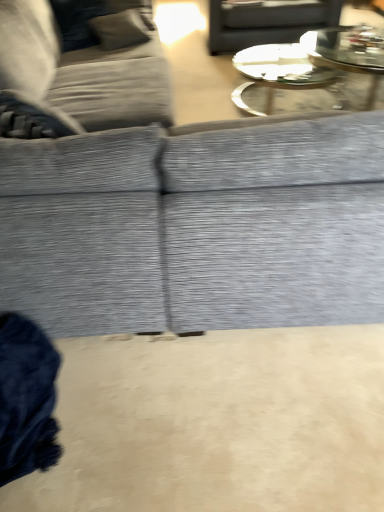
Image resolution: width=384 pixels, height=512 pixels. I want to click on matte gray tray at upper center, so click(266, 22).

This screenshot has width=384, height=512. In order to click on textured gray couch at upper left, which is counted as the 2th studio couch, starting from the right in this screenshot , I will do `click(81, 66)`.

Can textured gray couch at upper left, which ranks as the first studio couch in left-to-right order, be found inside textured gray fabric couch at center, which is the second studio couch from left to right?

Yes.

From the image's perspective, is textured gray fabric couch at center, which is the second studio couch from left to right, located above or below textured gray couch at upper left, which ranks as the first studio couch in left-to-right order?

Clearly, from the image's perspective, textured gray fabric couch at center, which is the second studio couch from left to right, is below textured gray couch at upper left, which ranks as the first studio couch in left-to-right order.

From a real-world perspective, is textured gray fabric couch at center, which is the second studio couch from left to right, positioned over textured gray couch at upper left, which is counted as the 2th studio couch, starting from the right, based on gravity?

Actually, textured gray fabric couch at center, which is the second studio couch from left to right, is physically below textured gray couch at upper left, which is counted as the 2th studio couch, starting from the right, in the real world.

Identify the location of studio couch above the textured gray fabric couch at center, positioned as the 1th studio couch in right-to-left order (from the image's perspective). (81, 66).

Considering the relative sizes of clear glass coffee table at upper center and textured gray couch at upper left, which ranks as the first studio couch in left-to-right order, in the image provided, is clear glass coffee table at upper center taller than textured gray couch at upper left, which ranks as the first studio couch in left-to-right order,?

In fact, clear glass coffee table at upper center may be shorter than textured gray couch at upper left, which ranks as the first studio couch in left-to-right order.

Considering the points (271, 105) and (23, 124), which point is behind, point (271, 105) or point (23, 124)?

Point (271, 105)

How different are the orientations of clear glass coffee table at upper center and textured gray couch at upper left, which is counted as the 2th studio couch, starting from the right, in degrees?

The angle between the facing direction of clear glass coffee table at upper center and the facing direction of textured gray couch at upper left, which is counted as the 2th studio couch, starting from the right, is 91.6 degrees.

Is textured gray couch at upper left, which is counted as the 2th studio couch, starting from the right, surrounded by clear glass coffee table at upper center?

No, textured gray couch at upper left, which is counted as the 2th studio couch, starting from the right, is not surrounded by clear glass coffee table at upper center.

At what (x,y) coordinates should I click in order to perform the action: click on gray above the textured gray fabric couch at center, positioned as the 1th studio couch in right-to-left order (from the image's perspective). Please return your answer as a coordinate pair (x, y). Looking at the image, I should click on (266, 22).

From a real-world perspective, is textured gray fabric couch at center, which is the second studio couch from left to right, beneath matte gray tray at upper center?

Actually, textured gray fabric couch at center, which is the second studio couch from left to right, is physically above matte gray tray at upper center in the real world.

Is textured gray fabric couch at center, which is the second studio couch from left to right, situated inside matte gray tray at upper center or outside?

textured gray fabric couch at center, which is the second studio couch from left to right, is not enclosed by matte gray tray at upper center.

Is point (283, 201) positioned behind point (274, 21)?

No, (283, 201) is in front of (274, 21).

Which of these two, textured gray couch at upper left, which ranks as the first studio couch in left-to-right order, or clear glass coffee table at upper center, is thinner?

textured gray couch at upper left, which ranks as the first studio couch in left-to-right order, is thinner.

From a real-world perspective, is textured gray couch at upper left, which ranks as the first studio couch in left-to-right order, over clear glass coffee table at upper center?

Indeed, from a real-world perspective, textured gray couch at upper left, which ranks as the first studio couch in left-to-right order, stands above clear glass coffee table at upper center.

How different are the orientations of textured gray couch at upper left, which ranks as the first studio couch in left-to-right order, and clear glass coffee table at upper center in degrees?

textured gray couch at upper left, which ranks as the first studio couch in left-to-right order, and clear glass coffee table at upper center are facing 91.6 degrees away from each other.

Does textured gray couch at upper left, which is counted as the 2th studio couch, starting from the right, have a larger size compared to clear glass coffee table at upper center?

Yes.

Can you confirm if textured gray couch at upper left, which is counted as the 2th studio couch, starting from the right, is thinner than matte gray tray at upper center?

No.

Which object is positioned more to the right, textured gray couch at upper left, which is counted as the 2th studio couch, starting from the right, or matte gray tray at upper center?

matte gray tray at upper center.

Is matte gray tray at upper center a part of textured gray couch at upper left, which is counted as the 2th studio couch, starting from the right?

No, matte gray tray at upper center is not a part of textured gray couch at upper left, which is counted as the 2th studio couch, starting from the right.

How far apart are textured gray couch at upper left, which ranks as the first studio couch in left-to-right order, and matte gray tray at upper center?

They are 4.60 feet apart.

Consider the image. Is textured gray couch at upper left, which is counted as the 2th studio couch, starting from the right, with textured gray fabric couch at center, positioned as the 1th studio couch in right-to-left order?

A: There is a gap between textured gray couch at upper left, which is counted as the 2th studio couch, starting from the right, and textured gray fabric couch at center, positioned as the 1th studio couch in right-to-left order.

Between textured gray couch at upper left, which is counted as the 2th studio couch, starting from the right, and textured gray fabric couch at center, positioned as the 1th studio couch in right-to-left order, which one is positioned in front?

textured gray fabric couch at center, positioned as the 1th studio couch in right-to-left order.

Considering the sizes of textured gray couch at upper left, which is counted as the 2th studio couch, starting from the right, and textured gray fabric couch at center, positioned as the 1th studio couch in right-to-left order, in the image, is textured gray couch at upper left, which is counted as the 2th studio couch, starting from the right, bigger or smaller than textured gray fabric couch at center, positioned as the 1th studio couch in right-to-left order,?

textured gray couch at upper left, which is counted as the 2th studio couch, starting from the right, is smaller than textured gray fabric couch at center, positioned as the 1th studio couch in right-to-left order.

Considering the sizes of objects textured gray couch at upper left, which ranks as the first studio couch in left-to-right order, and textured gray fabric couch at center, which is the second studio couch from left to right, in the image provided, who is wider, textured gray couch at upper left, which ranks as the first studio couch in left-to-right order, or textured gray fabric couch at center, which is the second studio couch from left to right,?

Wider between the two is textured gray fabric couch at center, which is the second studio couch from left to right.

Is matte gray tray at upper center oriented away from clear glass coffee table at upper center?

matte gray tray at upper center does not have its back to clear glass coffee table at upper center.

From a real-world perspective, between matte gray tray at upper center and clear glass coffee table at upper center, who is vertically higher?

matte gray tray at upper center, from a real-world perspective.

Can clear glass coffee table at upper center be found inside matte gray tray at upper center?

No, matte gray tray at upper center does not contain clear glass coffee table at upper center.

Which is behind, point (224, 50) or point (278, 79)?

The point (224, 50) is farther from the camera.

Where is `studio couch in front of the textured gray couch at upper left, which ranks as the first studio couch in left-to-right order`? This screenshot has width=384, height=512. studio couch in front of the textured gray couch at upper left, which ranks as the first studio couch in left-to-right order is located at coordinates (196, 227).

In the image, there is a textured gray couch at upper left, which is counted as the 2th studio couch, starting from the right. Where is `coffee table above it (from the image's perspective)`? Image resolution: width=384 pixels, height=512 pixels. coffee table above it (from the image's perspective) is located at coordinates (283, 74).

Estimate the real-world distances between objects in this image. Which object is closer to clear glass coffee table at upper center, textured gray fabric couch at center, which is the second studio couch from left to right, or matte gray tray at upper center?

The object closer to clear glass coffee table at upper center is matte gray tray at upper center.

Considering their positions, is clear glass coffee table at upper center positioned closer to textured gray couch at upper left, which is counted as the 2th studio couch, starting from the right, than matte gray tray at upper center?

Based on the image, clear glass coffee table at upper center appears to be nearer to textured gray couch at upper left, which is counted as the 2th studio couch, starting from the right.

Considering their positions, is textured gray fabric couch at center, positioned as the 1th studio couch in right-to-left order, positioned further to textured gray couch at upper left, which ranks as the first studio couch in left-to-right order, than matte gray tray at upper center?

matte gray tray at upper center.

Estimate the real-world distances between objects in this image. Which object is closer to clear glass coffee table at upper center, matte gray tray at upper center or textured gray fabric couch at center, positioned as the 1th studio couch in right-to-left order?

The object closer to clear glass coffee table at upper center is matte gray tray at upper center.

Looking at the image, which one is located further to matte gray tray at upper center, clear glass coffee table at upper center or textured gray couch at upper left, which ranks as the first studio couch in left-to-right order?

textured gray couch at upper left, which ranks as the first studio couch in left-to-right order, is positioned further to the anchor matte gray tray at upper center.

Considering their positions, is matte gray tray at upper center positioned further to textured gray fabric couch at center, which is the second studio couch from left to right, than clear glass coffee table at upper center?

The object further to textured gray fabric couch at center, which is the second studio couch from left to right, is matte gray tray at upper center.

Estimate the real-world distances between objects in this image. Which object is further from textured gray couch at upper left, which is counted as the 2th studio couch, starting from the right, matte gray tray at upper center or textured gray fabric couch at center, which is the second studio couch from left to right?

matte gray tray at upper center is positioned further to the anchor textured gray couch at upper left, which is counted as the 2th studio couch, starting from the right.

Looking at the image, which one is located closer to matte gray tray at upper center, textured gray fabric couch at center, which is the second studio couch from left to right, or textured gray couch at upper left, which is counted as the 2th studio couch, starting from the right?

The object closer to matte gray tray at upper center is textured gray couch at upper left, which is counted as the 2th studio couch, starting from the right.

The width and height of the screenshot is (384, 512). Find the location of `gray situated between textured gray couch at upper left, which is counted as the 2th studio couch, starting from the right, and clear glass coffee table at upper center from left to right`. gray situated between textured gray couch at upper left, which is counted as the 2th studio couch, starting from the right, and clear glass coffee table at upper center from left to right is located at coordinates (266, 22).

Locate an element on the screen. coffee table located between textured gray fabric couch at center, which is the second studio couch from left to right, and matte gray tray at upper center in the depth direction is located at coordinates (283, 74).

The width and height of the screenshot is (384, 512). In order to click on studio couch between textured gray fabric couch at center, which is the second studio couch from left to right, and clear glass coffee table at upper center, along the z-axis in this screenshot , I will do `click(81, 66)`.

Identify the location of studio couch between textured gray fabric couch at center, positioned as the 1th studio couch in right-to-left order, and matte gray tray at upper center from front to back. pos(81,66).